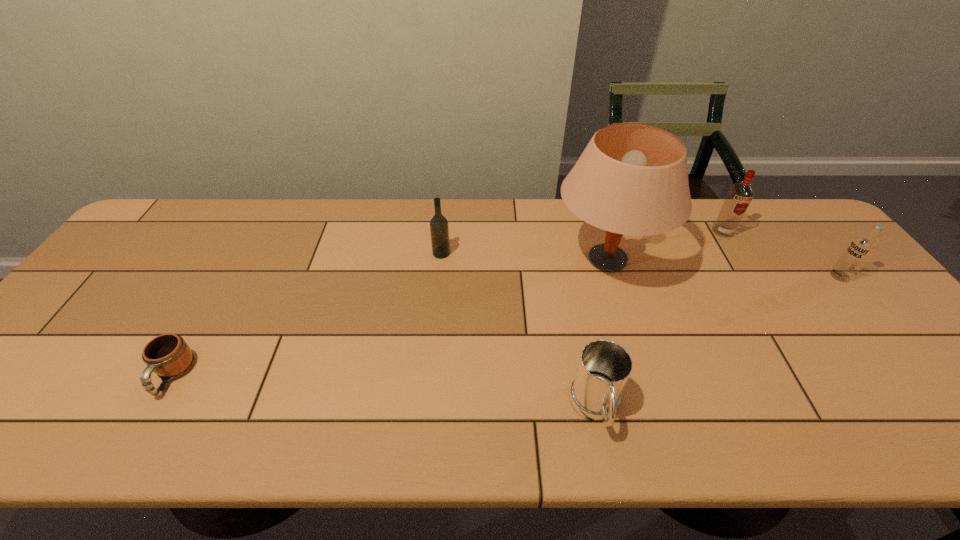
Identify the location of object at the near edge. (604, 367).

Identify the location of object situated at the right edge. The width and height of the screenshot is (960, 540). (861, 249).

Locate an element on the screen. This screenshot has width=960, height=540. vacant area at the far edge is located at coordinates (530, 234).

Image resolution: width=960 pixels, height=540 pixels. Identify the location of vacant space at the near edge of the desktop. (518, 416).

The image size is (960, 540). I want to click on vacant space at the left edge of the desktop, so click(150, 253).

The image size is (960, 540). I want to click on vacant space at the right edge of the desktop, so click(871, 302).

Find the location of a particular element. Image resolution: width=960 pixels, height=540 pixels. free region at the far left corner is located at coordinates (198, 202).

You are a GUI agent. You are given a task and a screenshot of the screen. Output one action in this format:
    pyautogui.click(x=<x>, y=<y>)
    Task: Click on the vacant space at the far right corner of the desktop
    The height and width of the screenshot is (540, 960).
    Given the screenshot: What is the action you would take?
    tap(814, 243)

Find the location of a particular element. vacant space at the near right corner of the desktop is located at coordinates point(920,430).

Image resolution: width=960 pixels, height=540 pixels. What are the coordinates of `vacant space in between the rightmost vodka and the right mug` in the screenshot? It's located at [x=718, y=342].